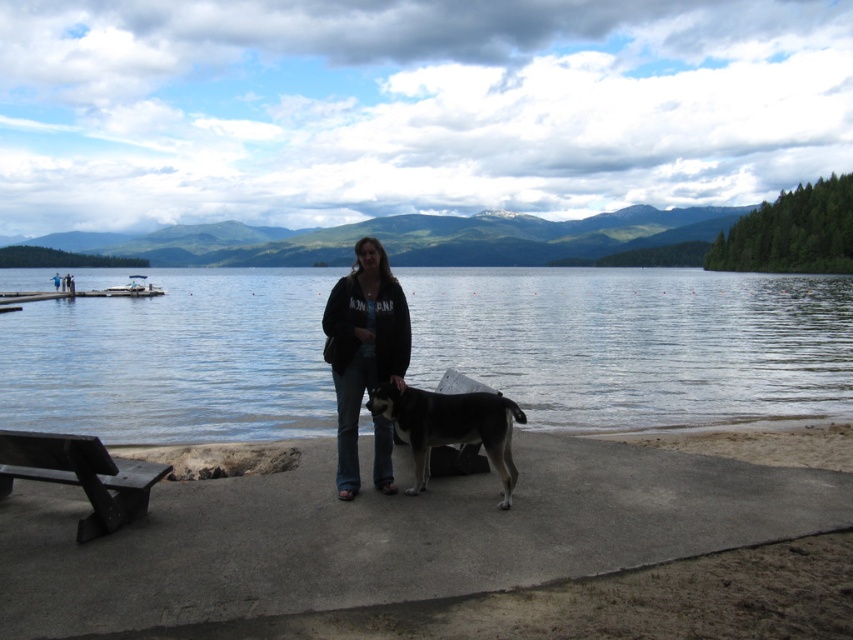
Question: Which object appears closest to the camera in this image?

Choices:
 (A) dark gray fleece jacket at center
 (B) black wood bench at lower left
 (C) clear water at center
 (D) sandy concrete at lower center

Answer: (D)

Question: Does black wood bench at lower left have a larger size compared to black and white fur dog at center?

Choices:
 (A) yes
 (B) no

Answer: (A)

Question: Among these points, which one is farthest from the camera?

Choices:
 (A) (415, 406)
 (B) (154, 605)

Answer: (A)

Question: Is clear water at center bigger than black and white fur dog at center?

Choices:
 (A) yes
 (B) no

Answer: (A)

Question: Does sandy concrete at lower center appear on the left side of dark gray fleece jacket at center?

Choices:
 (A) no
 (B) yes

Answer: (A)

Question: Which point is farther from the camera taking this photo?

Choices:
 (A) (521, 500)
 (B) (848, 316)

Answer: (B)